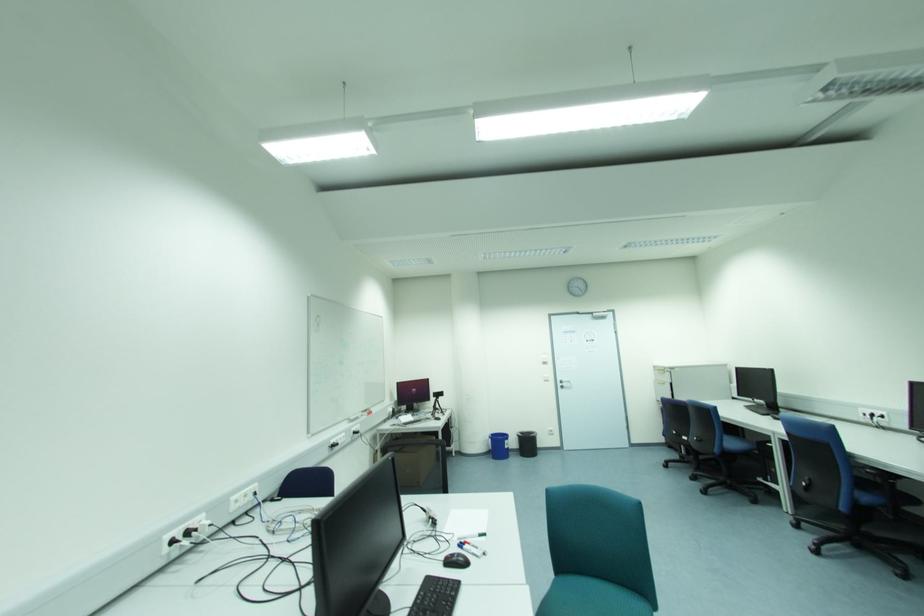
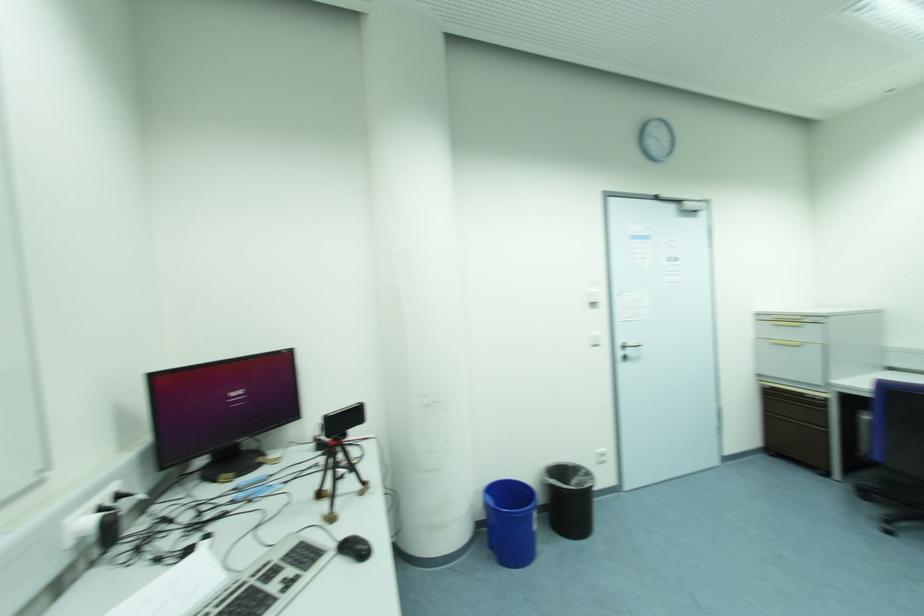
Question: What movement of the cameraman would produce the second image?

Choices:
 (A) Left
 (B) Right
 (C) Forward
 (D) Backward

Answer: (C)